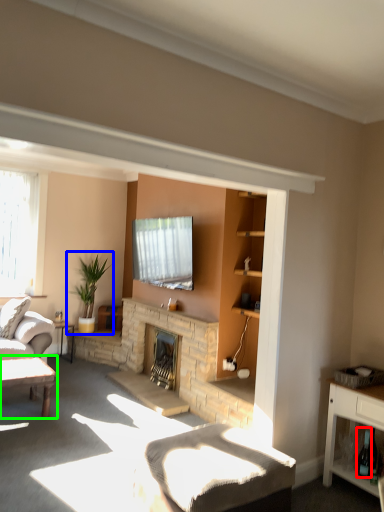
Question: Estimate the real-world distances between objects in this image. Which object is closer to wine bottle (highlighted by a red box), houseplant (highlighted by a blue box) or table (highlighted by a green box)?

Choices:
 (A) houseplant
 (B) table

Answer: (B)